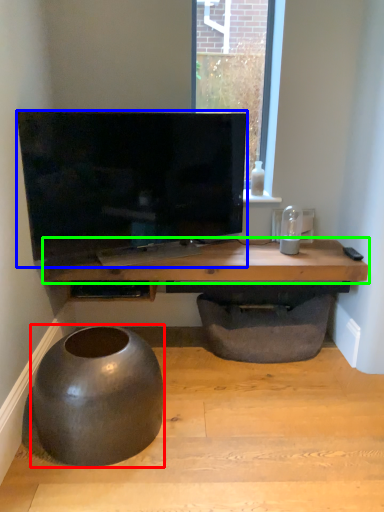
Question: Considering the real-world distances, which object is closest to round table (highlighted by a red box)? television (highlighted by a blue box) or table (highlighted by a green box).

Choices:
 (A) television
 (B) table

Answer: (B)